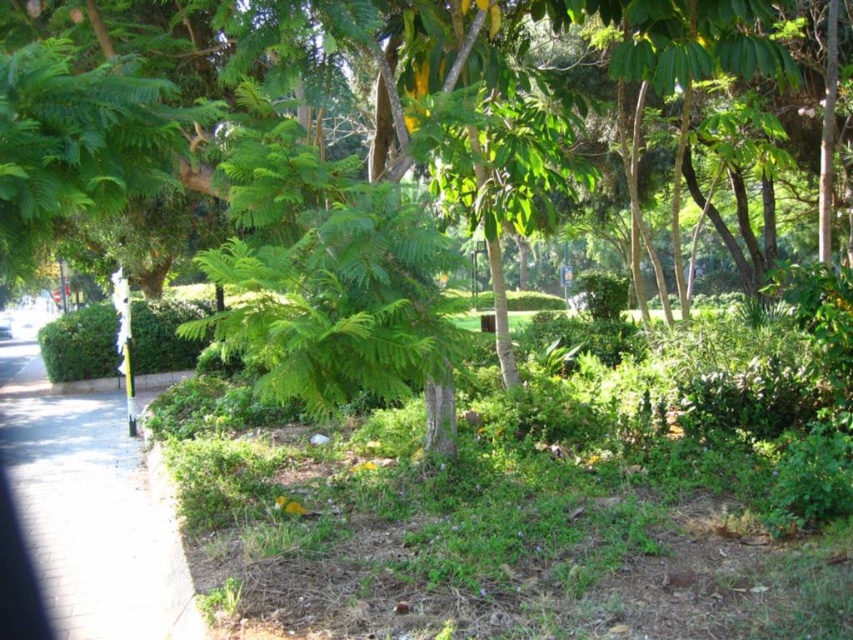
Question: Estimate the real-world distances between objects in this image. Which object is farther from the green leafy tree at center?

Choices:
 (A) green leafy grass at center
 (B) green leafy bush at center
 (C) brick paved sidewalk at left

Answer: (B)

Question: Among these objects, which one is farthest from the camera?

Choices:
 (A) green leafy bush at center
 (B) brick paved sidewalk at left
 (C) green leafy tree at center

Answer: (A)

Question: Observing the image, what is the correct spatial positioning of green leafy grass at center in reference to brick paved sidewalk at left?

Choices:
 (A) above
 (B) below

Answer: (A)

Question: Estimate the real-world distances between objects in this image. Which object is closer to the green leafy bush at center?

Choices:
 (A) green leafy tree at center
 (B) green leafy grass at center

Answer: (A)

Question: Is brick paved sidewalk at left to the right of green leafy bush at center from the viewer's perspective?

Choices:
 (A) no
 (B) yes

Answer: (B)

Question: Is green leafy tree at center thinner than green leafy bush at center?

Choices:
 (A) yes
 (B) no

Answer: (A)